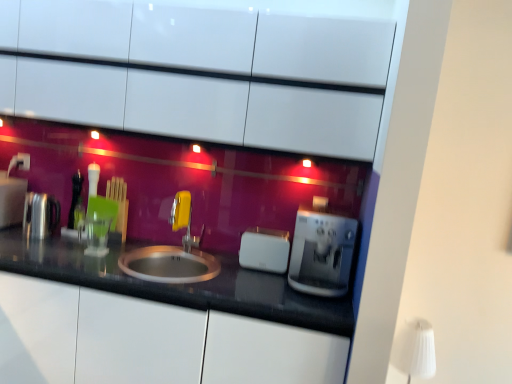
Question: Is white plastic electric outlet at upper left oriented away from white fabric lampshade at upper right?

Choices:
 (A) yes
 (B) no

Answer: (B)

Question: Is white plastic electric outlet at upper left smaller than white fabric lampshade at upper right?

Choices:
 (A) yes
 (B) no

Answer: (A)

Question: Is white plastic electric outlet at upper left positioned beyond the bounds of white fabric lampshade at upper right?

Choices:
 (A) no
 (B) yes

Answer: (B)

Question: Considering the relative positions of white plastic electric outlet at upper left and white fabric lampshade at upper right in the image provided, is white plastic electric outlet at upper left to the left of white fabric lampshade at upper right from the viewer's perspective?

Choices:
 (A) no
 (B) yes

Answer: (B)

Question: Can white fabric lampshade at upper right be found inside white plastic electric outlet at upper left?

Choices:
 (A) no
 (B) yes

Answer: (A)

Question: Based on their sizes in the image, would you say black granite countertop at center is bigger or smaller than yellow plastic faucet at center?

Choices:
 (A) big
 (B) small

Answer: (A)

Question: Is black granite countertop at center spatially inside yellow plastic faucet at center, or outside of it?

Choices:
 (A) outside
 (B) inside

Answer: (A)

Question: Is point (74, 256) closer or farther from the camera than point (170, 208)?

Choices:
 (A) closer
 (B) farther

Answer: (A)

Question: In the image, is black granite countertop at center positioned in front of or behind yellow plastic faucet at center?

Choices:
 (A) front
 (B) behind

Answer: (A)

Question: Looking at the image, does white plastic electric outlet at upper left seem bigger or smaller compared to yellow plastic faucet at center?

Choices:
 (A) big
 (B) small

Answer: (B)

Question: Is white plastic electric outlet at upper left to the left or to the right of yellow plastic faucet at center in the image?

Choices:
 (A) right
 (B) left

Answer: (B)

Question: From a real-world perspective, is white plastic electric outlet at upper left positioned above or below yellow plastic faucet at center?

Choices:
 (A) above
 (B) below

Answer: (A)

Question: Is point (17, 163) closer or farther from the camera than point (190, 243)?

Choices:
 (A) farther
 (B) closer

Answer: (A)

Question: From the image's perspective, is white glossy cabinets at upper center located above or below black granite countertop at center?

Choices:
 (A) below
 (B) above

Answer: (B)

Question: From a real-world perspective, is white glossy cabinets at upper center positioned above or below black granite countertop at center?

Choices:
 (A) below
 (B) above

Answer: (B)